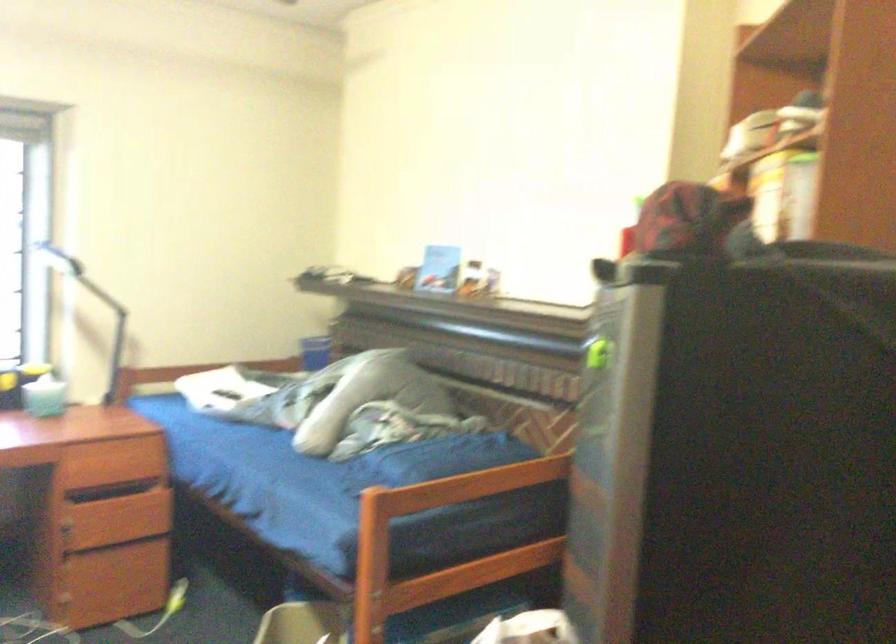
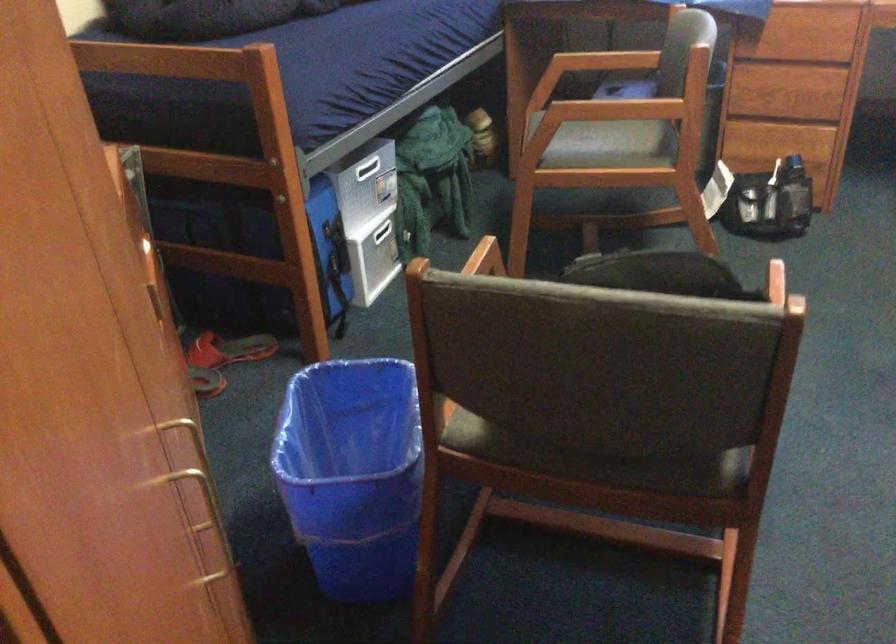
Based on the photo, first-person continuous shooting, in which direction is the camera rotating?

The camera's rotation is toward left-down.